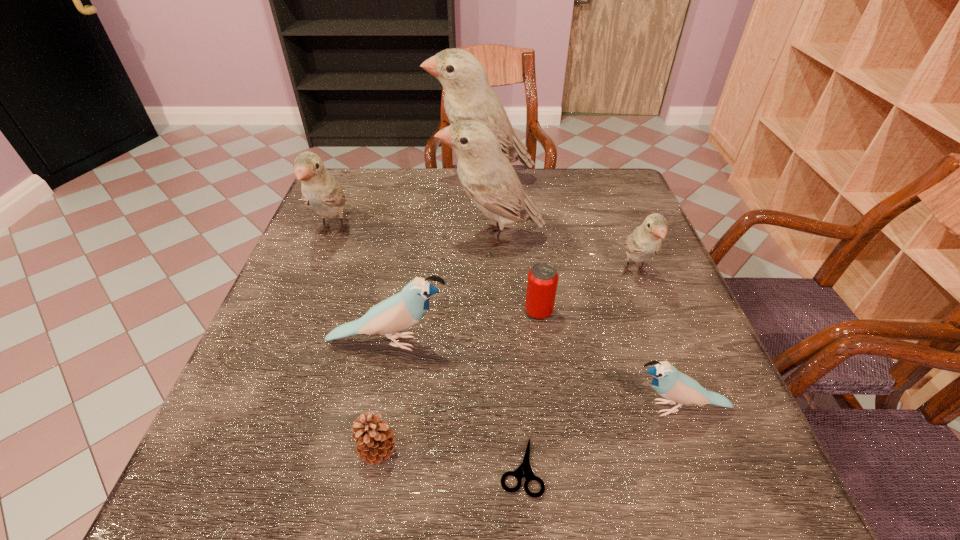
Find the location of a particular element. the tallest object is located at coordinates [468, 95].

This screenshot has height=540, width=960. Find the location of `the tallest bird`. the tallest bird is located at coordinates (468, 95).

Locate an element on the screen. the second tallest bird is located at coordinates (487, 176).

Identify the location of the third smallest white bird. This screenshot has width=960, height=540. (487, 176).

Where is `the leftmost bird`? The image size is (960, 540). the leftmost bird is located at coordinates (320, 190).

The height and width of the screenshot is (540, 960). Find the location of `the leftmost white bird`. the leftmost white bird is located at coordinates (320, 190).

You are a GUI agent. You are given a task and a screenshot of the screen. Output one action in this format:
    pyautogui.click(x=<x>, y=<y>)
    Task: Click on the smallest white bird
    Image resolution: width=960 pixels, height=540 pixels.
    Given the screenshot: What is the action you would take?
    [645, 241]

At what (x,y) coordinates should I click in order to perform the action: click on the second nearest bird. Please return your answer as a coordinate pair (x, y). Looking at the image, I should click on (401, 311).

You are a GUI agent. You are given a task and a screenshot of the screen. Output one action in this format:
    pyautogui.click(x=<x>, y=<y>)
    Task: Click on the sixth farthest object
    
    Given the screenshot: What is the action you would take?
    pyautogui.click(x=401, y=311)

Find the location of a particular element. The height and width of the screenshot is (540, 960). the right blue bird is located at coordinates (668, 382).